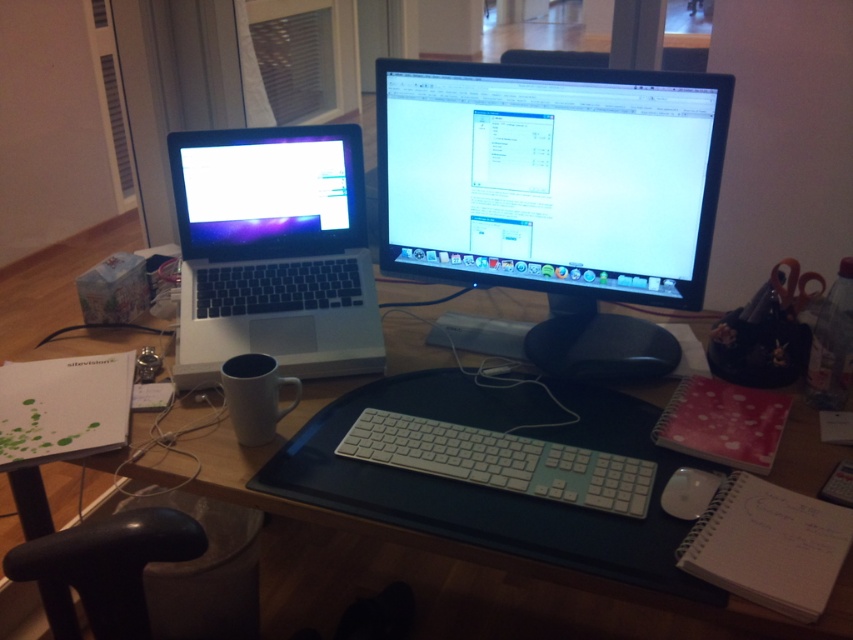
From the picture: Does white plastic keyboard at center have a lesser height compared to white matte coffee cup at lower left?

Indeed, white plastic keyboard at center has a lesser height compared to white matte coffee cup at lower left.

Is point (404, 433) more distant than point (258, 365)?

No, (404, 433) is in front of (258, 365).

Where is `white plastic keyboard at center`? This screenshot has height=640, width=853. white plastic keyboard at center is located at coordinates (502, 460).

Is satin black monitor at center positioned behind white plastic mouse at lower right?

Yes, satin black monitor at center is further from the viewer.

The width and height of the screenshot is (853, 640). What do you see at coordinates (556, 195) in the screenshot?
I see `satin black monitor at center` at bounding box center [556, 195].

This screenshot has height=640, width=853. Find the location of `satin black monitor at center`. satin black monitor at center is located at coordinates (556, 195).

Is the position of satin black monitor at center less distant than that of white matte coffee cup at lower left?

That is False.

Between point (567, 292) and point (242, 388), which one is positioned in front?

Positioned in front is point (242, 388).

I want to click on satin black monitor at center, so click(556, 195).